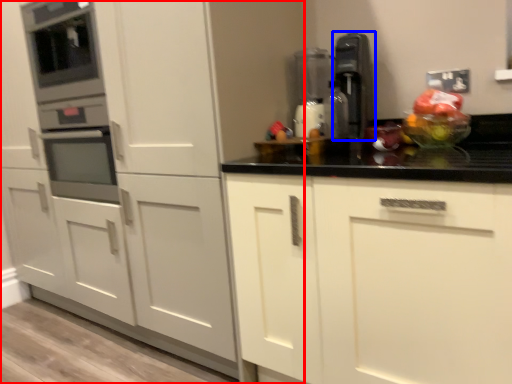
Question: Which point is further to the camera, cabinetry (highlighted by a red box) or kitchen appliance (highlighted by a blue box)?

Choices:
 (A) cabinetry
 (B) kitchen appliance

Answer: (B)